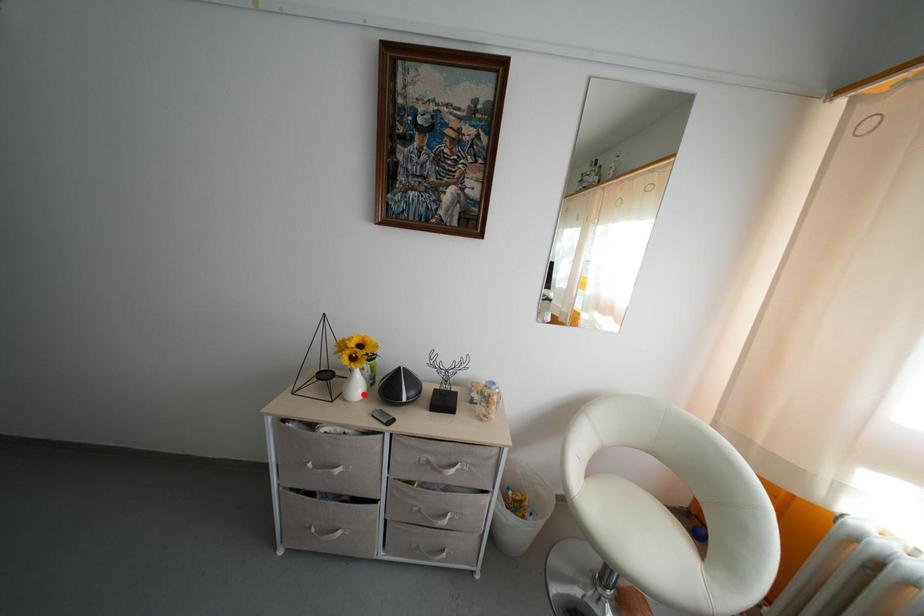
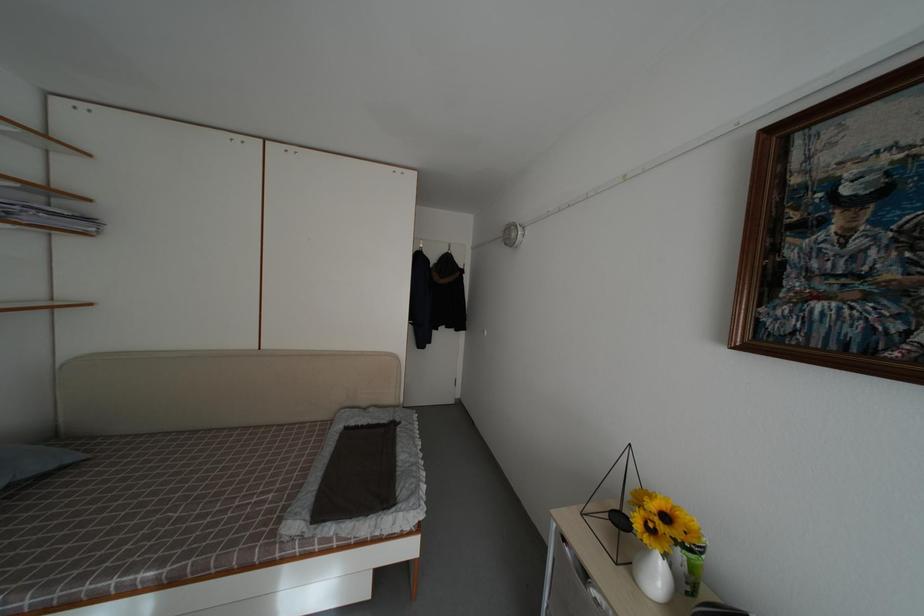
Where in the second image is the point corresponding to the highlighted location from the first image?

(664, 584)